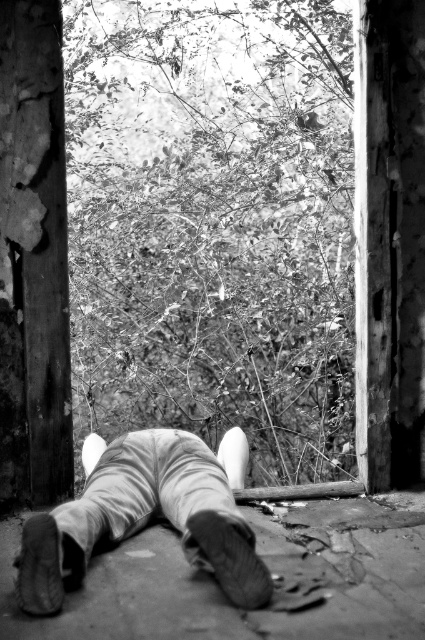
Can you confirm if rusty metal pillar at left is positioned to the left of smooth concrete pillar at right?

Correct, you'll find rusty metal pillar at left to the left of smooth concrete pillar at right.

Find the location of a particular element. Image resolution: width=425 pixels, height=640 pixels. rusty metal pillar at left is located at coordinates (33, 259).

Is smooth concrete pillar at right taller than leather shoes at lower center?

Correct, smooth concrete pillar at right is much taller as leather shoes at lower center.

Between point (408, 64) and point (150, 477), which one is positioned in front?

Point (150, 477) is in front.

Between point (368, 477) and point (34, 593), which one is positioned in front?

Point (34, 593) is more forward.

The image size is (425, 640). Find the location of `smooth concrete pillar at right`. smooth concrete pillar at right is located at coordinates (390, 241).

Which is more to the right, rusty metal pillar at left or leather shoes at lower center?

Positioned to the right is leather shoes at lower center.

Is rusty metal pillar at left bigger than leather shoes at lower center?

Actually, rusty metal pillar at left might be smaller than leather shoes at lower center.

Is point (25, 324) positioned before point (175, 509)?

No.

Where is `rusty metal pillar at left`? rusty metal pillar at left is located at coordinates (33, 259).